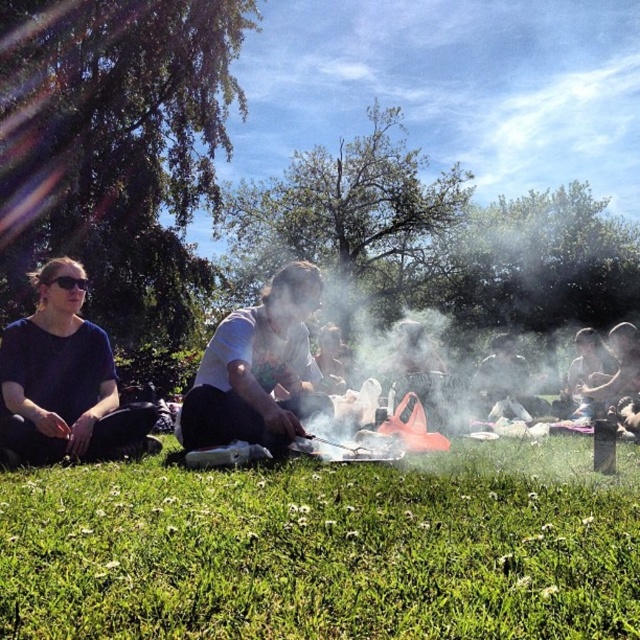
Question: Which of the following is the farthest from the observer?

Choices:
 (A) (52, 355)
 (B) (268, 632)
 (C) (275, 312)

Answer: (A)

Question: Which of the following is the farthest from the observer?

Choices:
 (A) (224, 374)
 (B) (29, 564)

Answer: (A)

Question: Which object is closer to the camera taking this photo?

Choices:
 (A) matte black shirt at left
 (B) green grass at lower center
 (C) white matte grill at center

Answer: (B)

Question: Does green grass at lower center lie behind matte black shirt at left?

Choices:
 (A) no
 (B) yes

Answer: (A)

Question: Observing the image, what is the correct spatial positioning of matte black shirt at left in reference to white matte grill at center?

Choices:
 (A) right
 (B) left

Answer: (B)

Question: Does green grass at lower center come behind white matte grill at center?

Choices:
 (A) no
 (B) yes

Answer: (A)